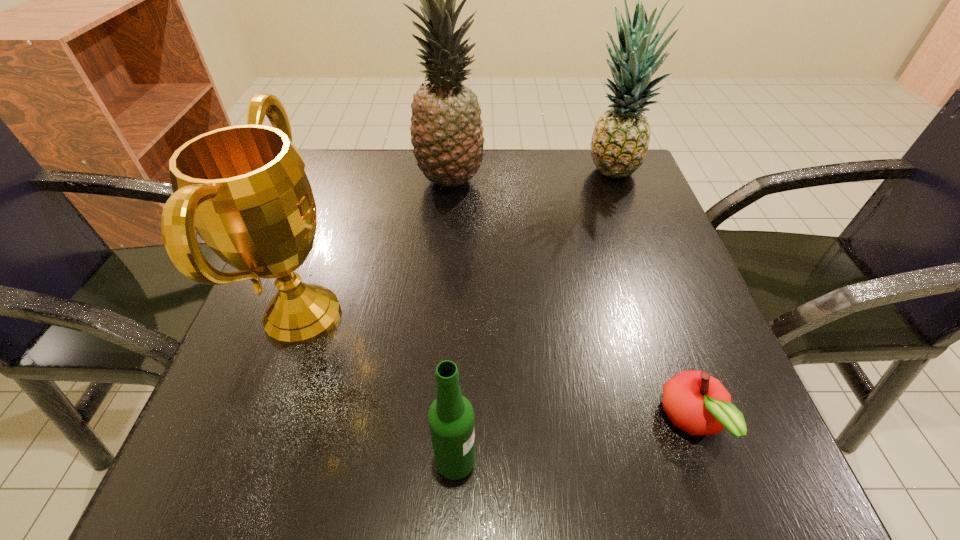
You are a GUI agent. You are given a task and a screenshot of the screen. Output one action in this format:
    pyautogui.click(x=<x>, y=<y>)
    Task: Click on the left pineapple
    Image resolution: width=960 pixels, height=540 pixels.
    Given the screenshot: What is the action you would take?
    pyautogui.click(x=446, y=133)

The image size is (960, 540). In order to click on the right pineapple in this screenshot , I will do `click(620, 141)`.

Image resolution: width=960 pixels, height=540 pixels. Find the location of `award`. award is located at coordinates (243, 188).

Find the location of a particular element. The width and height of the screenshot is (960, 540). the fourth tallest object is located at coordinates (451, 416).

Where is `the shortest object`? The height and width of the screenshot is (540, 960). the shortest object is located at coordinates (697, 403).

Locate an element on the screen. free space located 0.060m on the right of the left pineapple is located at coordinates (511, 181).

You are a GUI agent. You are given a task and a screenshot of the screen. Output one action in this format:
    pyautogui.click(x=<x>, y=<y>)
    Task: Click on the vacant space located 0.280m on the left of the right pineapple
    This screenshot has height=540, width=960.
    Given the screenshot: What is the action you would take?
    pyautogui.click(x=460, y=172)

Locate an element on the screen. vacant space located 0.250m on the front-facing side of the leftmost object is located at coordinates (498, 315).

Find the location of a particular element. vacant space located on the label of the beer bottle is located at coordinates (677, 460).

Find the location of `blank area located 0.200m on the back of the apple`. blank area located 0.200m on the back of the apple is located at coordinates (644, 285).